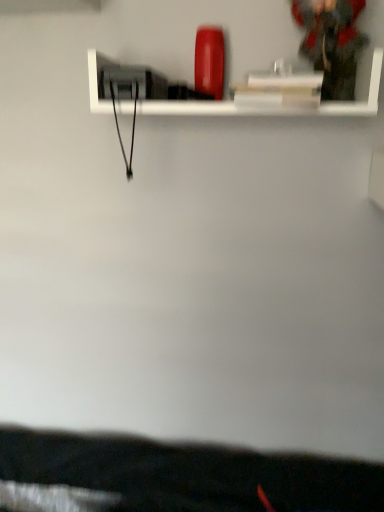
Question: From a real-world perspective, is white glossy shelf at upper center above or below dark gray fabric jacket at upper right?

Choices:
 (A) below
 (B) above

Answer: (A)

Question: Is white glossy shelf at upper center in front of or behind dark gray fabric jacket at upper right in the image?

Choices:
 (A) behind
 (B) front

Answer: (B)

Question: Visually, is white glossy shelf at upper center positioned to the left or to the right of dark gray fabric jacket at upper right?

Choices:
 (A) left
 (B) right

Answer: (A)

Question: In terms of width, does dark gray fabric jacket at upper right look wider or thinner when compared to white glossy shelf at upper center?

Choices:
 (A) wide
 (B) thin

Answer: (B)

Question: Based on their sizes in the image, would you say dark gray fabric jacket at upper right is bigger or smaller than white glossy shelf at upper center?

Choices:
 (A) small
 (B) big

Answer: (A)

Question: In terms of height, does dark gray fabric jacket at upper right look taller or shorter compared to white glossy shelf at upper center?

Choices:
 (A) tall
 (B) short

Answer: (A)

Question: From a real-world perspective, is dark gray fabric jacket at upper right physically located above or below white glossy shelf at upper center?

Choices:
 (A) above
 (B) below

Answer: (A)